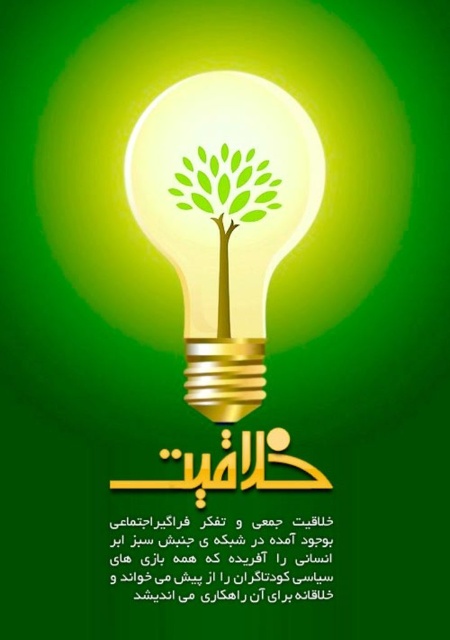
Question: Which object is closer to the camera taking this photo?

Choices:
 (A) gold metallic bulb at center
 (B) green matte tree at center

Answer: (A)

Question: Is gold metallic bulb at center below green matte tree at center?

Choices:
 (A) yes
 (B) no

Answer: (A)

Question: Which of the following is the closest to the observer?

Choices:
 (A) (242, 172)
 (B) (286, 154)

Answer: (B)

Question: Is gold metallic bulb at center further to the viewer compared to green matte tree at center?

Choices:
 (A) yes
 (B) no

Answer: (B)

Question: Is gold metallic bulb at center bigger than green matte tree at center?

Choices:
 (A) yes
 (B) no

Answer: (A)